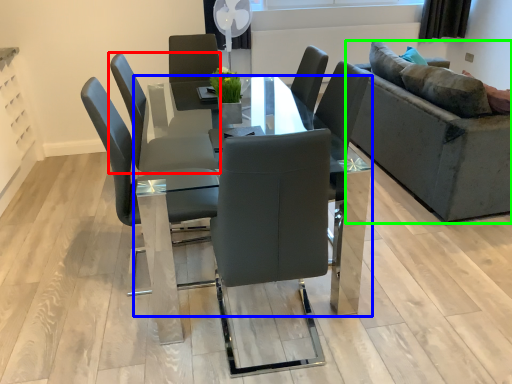
Question: Which is nearer to the chair (highlighted by a red box)? table (highlighted by a blue box) or studio couch (highlighted by a green box).

Choices:
 (A) table
 (B) studio couch

Answer: (A)